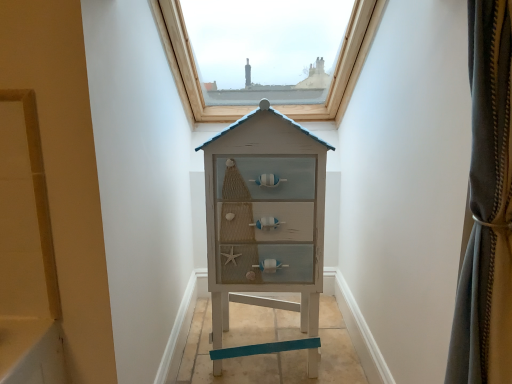
Question: Does wooden frame at upper center lie in front of white distressed wood chest of drawers at center?

Choices:
 (A) no
 (B) yes

Answer: (A)

Question: Is wooden frame at upper center far away from white distressed wood chest of drawers at center?

Choices:
 (A) yes
 (B) no

Answer: (B)

Question: Is wooden frame at upper center thinner than white distressed wood chest of drawers at center?

Choices:
 (A) yes
 (B) no

Answer: (B)

Question: Is wooden frame at upper center further to the viewer compared to white distressed wood chest of drawers at center?

Choices:
 (A) yes
 (B) no

Answer: (A)

Question: Is the surface of wooden frame at upper center in direct contact with white distressed wood chest of drawers at center?

Choices:
 (A) yes
 (B) no

Answer: (B)

Question: Is wooden frame at upper center shorter than white distressed wood chest of drawers at center?

Choices:
 (A) no
 (B) yes

Answer: (B)

Question: From the image's perspective, is white distressed wood chest of drawers at center located above wooden frame at upper center?

Choices:
 (A) yes
 (B) no

Answer: (B)

Question: Does white distressed wood chest of drawers at center have a lesser width compared to wooden frame at upper center?

Choices:
 (A) yes
 (B) no

Answer: (A)

Question: Can you confirm if white distressed wood chest of drawers at center is bigger than wooden frame at upper center?

Choices:
 (A) yes
 (B) no

Answer: (B)

Question: From a real-world perspective, is white distressed wood chest of drawers at center positioned over wooden frame at upper center based on gravity?

Choices:
 (A) no
 (B) yes

Answer: (A)

Question: Is there a large distance between white distressed wood chest of drawers at center and wooden frame at upper center?

Choices:
 (A) yes
 (B) no

Answer: (B)

Question: Is white distressed wood chest of drawers at center shorter than wooden frame at upper center?

Choices:
 (A) yes
 (B) no

Answer: (B)

Question: Considering their positions, is white distressed wood chest of drawers at center located in front of or behind wooden frame at upper center?

Choices:
 (A) behind
 (B) front

Answer: (B)